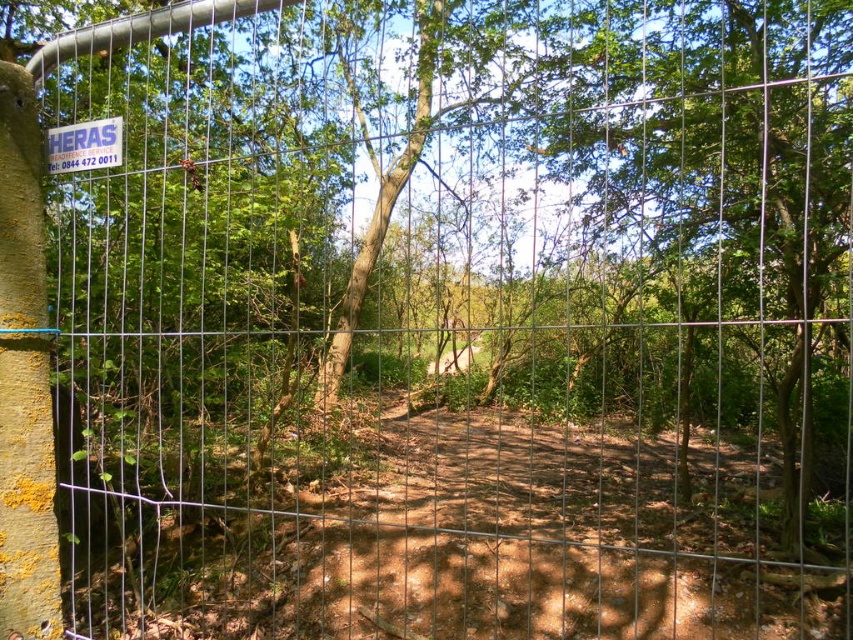
You are a hiker planning to follow the path shown in the image. You see the brown dirt track at center and the white plastic sign at upper left. Which object is positioned higher up in the image?

The white plastic sign at upper left is positioned higher up in the image than the brown dirt track at center.

You are standing at the entrance of the fenced area and want to follow the path into the woods. Which object, the brown dirt track at center or the white plastic sign at upper left, is closer to you as you start walking?

The brown dirt track at center is closer to the viewer than the white plastic sign at upper left, so the dirt track is closer as you start walking.